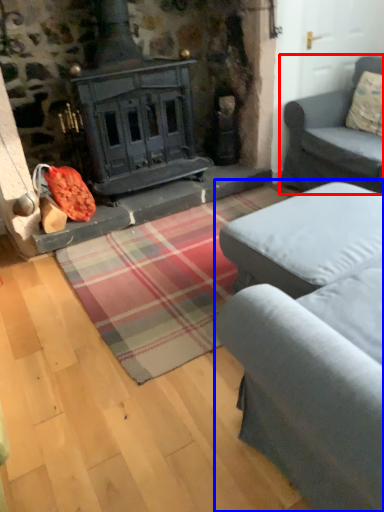
Question: Which of the following is the closest to the observer, studio couch (highlighted by a red box) or studio couch (highlighted by a blue box)?

Choices:
 (A) studio couch
 (B) studio couch

Answer: (B)